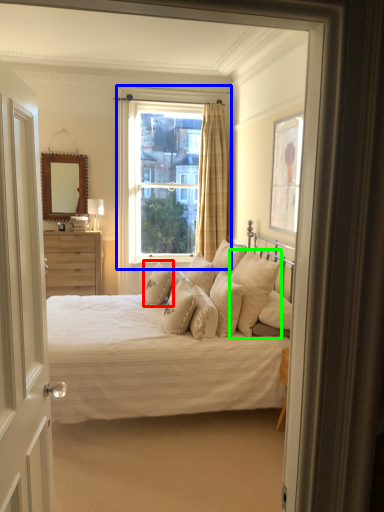
Question: Based on their relative distances, which object is nearer to pillow (highlighted by a red box)? Choose from window (highlighted by a blue box) and pillow (highlighted by a green box).

Choices:
 (A) window
 (B) pillow

Answer: (B)